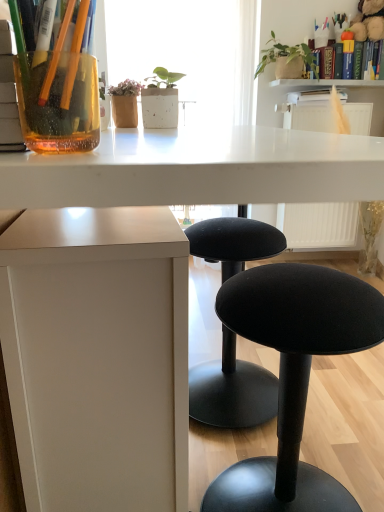
Identify the location of vacant region to the right of translucent orange glass at upper left. Image resolution: width=384 pixels, height=512 pixels. (199, 151).